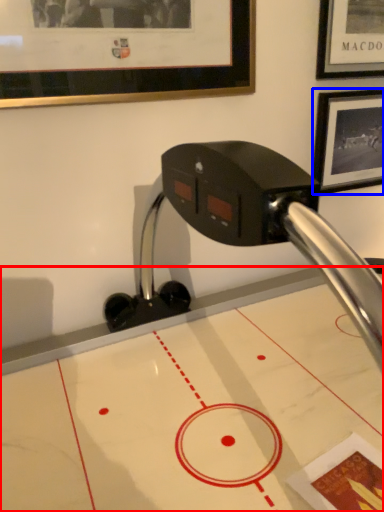
Question: Which object appears farthest to the camera in this image, table (highlighted by a red box) or picture frame (highlighted by a blue box)?

Choices:
 (A) table
 (B) picture frame

Answer: (B)